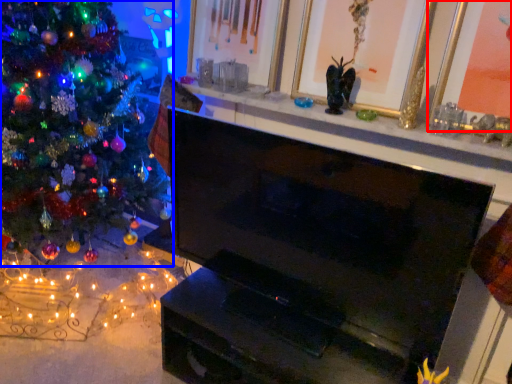
Question: Among these objects, which one is farthest to the camera, picture frame (highlighted by a red box) or christmas tree (highlighted by a blue box)?

Choices:
 (A) picture frame
 (B) christmas tree

Answer: (B)